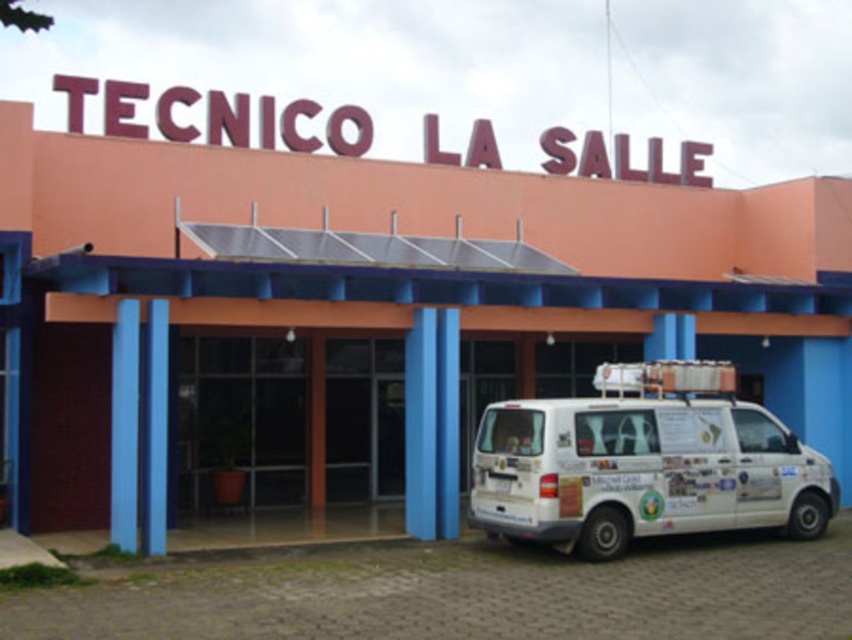
You are a delivery person approaching the entrance of the building. You see a white van at center and a white matte van at lower right. Which van is closer to the entrance?

The white van at center is closer to the entrance because it is located above the white matte van at lower right, which is positioned further down from the entrance.

You are a delivery person arriving at TECNICO LA SALLE. You see a white van at center and a white matte van at lower right parked near the entrance. Which van is wider?

The white van at center might be wider than white matte van at lower right.

You are standing in front of the building and see the point at coordinates (370, 314). What object is this point located on?

The point at coordinates (370, 314) is located on the white van at center.